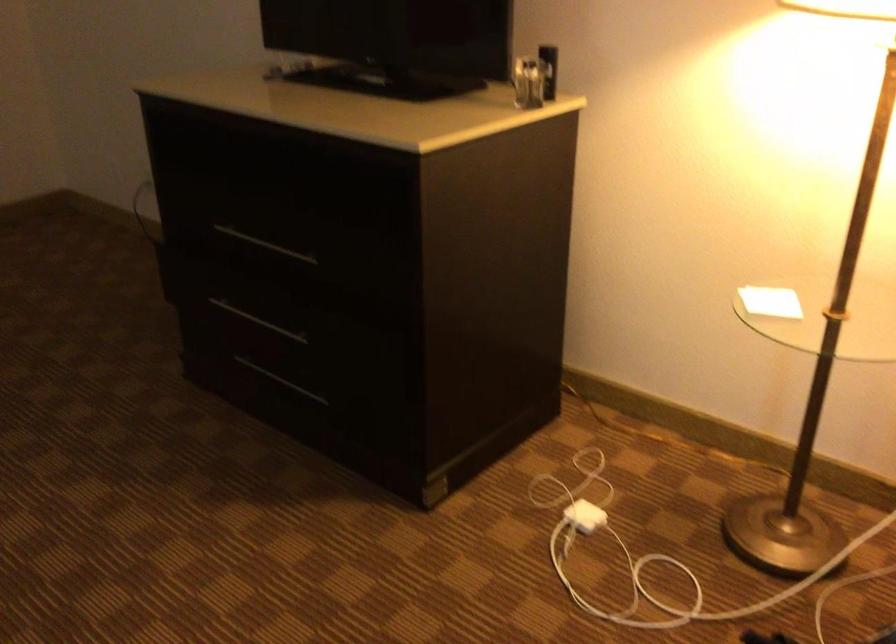
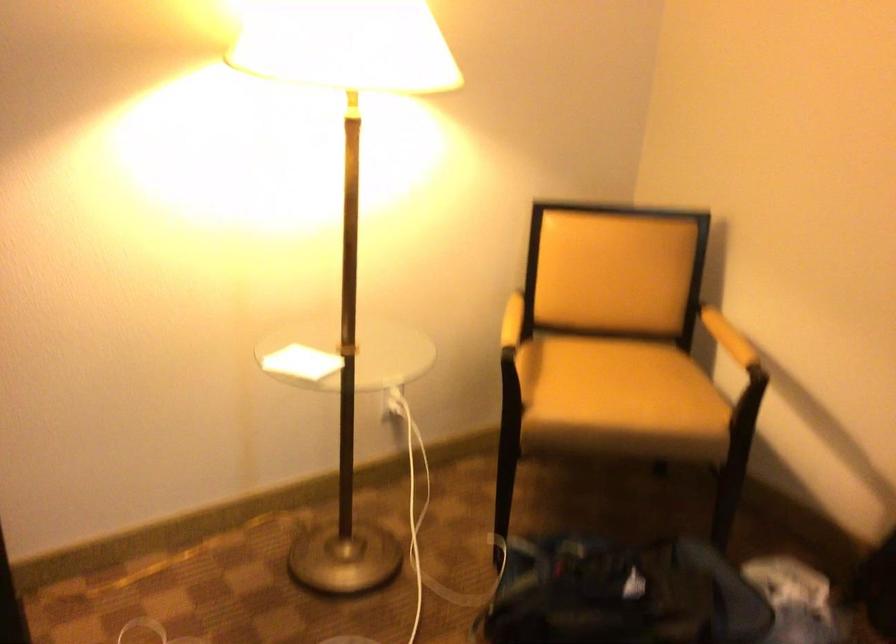
Locate, in the second image, the point that corresponds to (769,299) in the first image.

(300, 363)